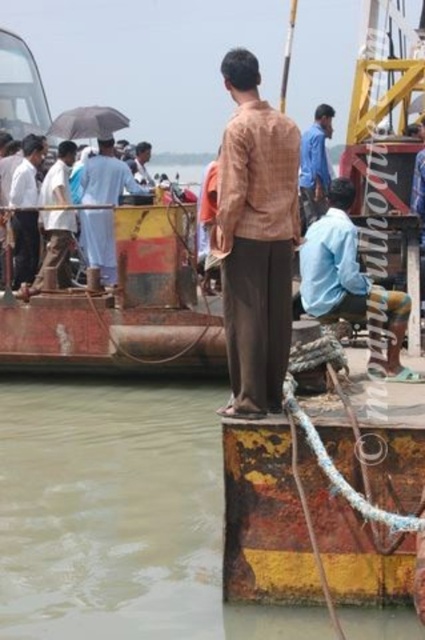
You are standing on the weathered metal structure in the foreground. You see two people in the midground wearing a light blue shirt at center and a light brown fabric shirt at center. If you want to throw a small object to one of them, which one can you reach without needing to stretch too far?

The light blue shirt at center is closer to you than the light brown fabric shirt at center, so you can reach the light blue shirt at center without stretching too far.

You are standing at the river port and see the brown murky water at lower left and the light brown fabric shirt at center. Which object is positioned lower in the image?

The brown murky water at lower left is positioned below the light brown fabric shirt at center, so it is lower in the image.

Looking at this image, you are navigating a small boat and need to avoid the brown murky water at lower left. According to the coordinates provided, where should you steer your boat to stay safe?

The brown murky water at lower left is located at point (110, 512), so you should steer your boat away from that coordinate to avoid it.